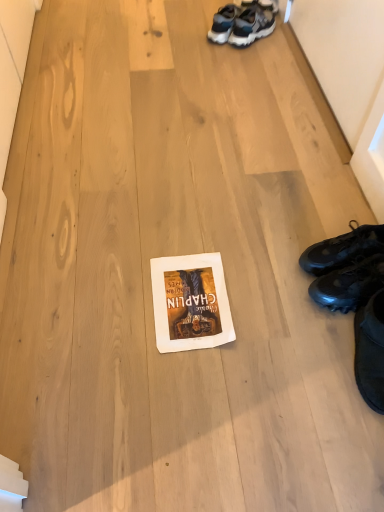
Question: In terms of height, does black leather shoes at right, which is counted as the first footwear, starting from the top, look taller or shorter compared to white paper at center?

Choices:
 (A) short
 (B) tall

Answer: (B)

Question: Considering their positions, is black leather shoes at right, the second footwear when ordered from bottom to top, located in front of or behind white paper at center?

Choices:
 (A) behind
 (B) front

Answer: (A)

Question: Based on their relative distances, which object is farther from the white paper at center?

Choices:
 (A) black leather shoes at right, which is counted as the first footwear, starting from the top
 (B) black matte sneakers at lower right, acting as the first footwear starting from the bottom

Answer: (A)

Question: Which of these objects is positioned closest to the black matte sneakers at lower right, acting as the first footwear starting from the bottom?

Choices:
 (A) black leather shoes at right, which is counted as the first footwear, starting from the top
 (B) white paper at center

Answer: (A)